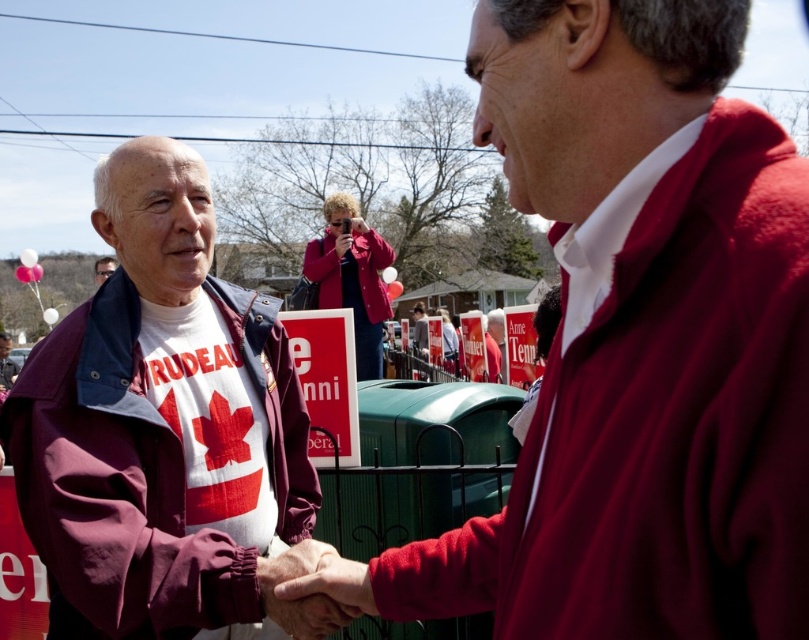
You are a photographer at the event and need to take a photo of the pink fabric camera at center. However, the maroon fleece jacket at center is blocking your view. Can you still capture the camera in the shot?

The maroon fleece jacket at center is in front of the pink fabric camera at center, so it is blocking the view. Therefore, you cannot capture the pink fabric camera at center in the shot without moving the jacket or changing your angle.

You are a photographer at the event and want to take a photo of the maroon fleece jacket at center without the pink fabric camera at center appearing in the shot. Is this possible given their positions?

The maroon fleece jacket at center is positioned under the pink fabric camera at center, so the camera would block the jacket in the photo. To avoid this, you would need to adjust your angle or move the camera.